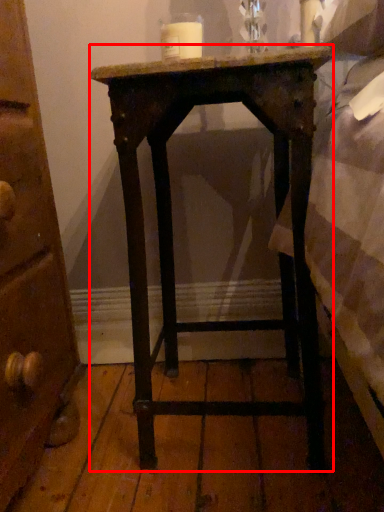
Question: From the image's perspective, where is nightstand (annotated by the red box) located relative to candle?

Choices:
 (A) above
 (B) below

Answer: (B)